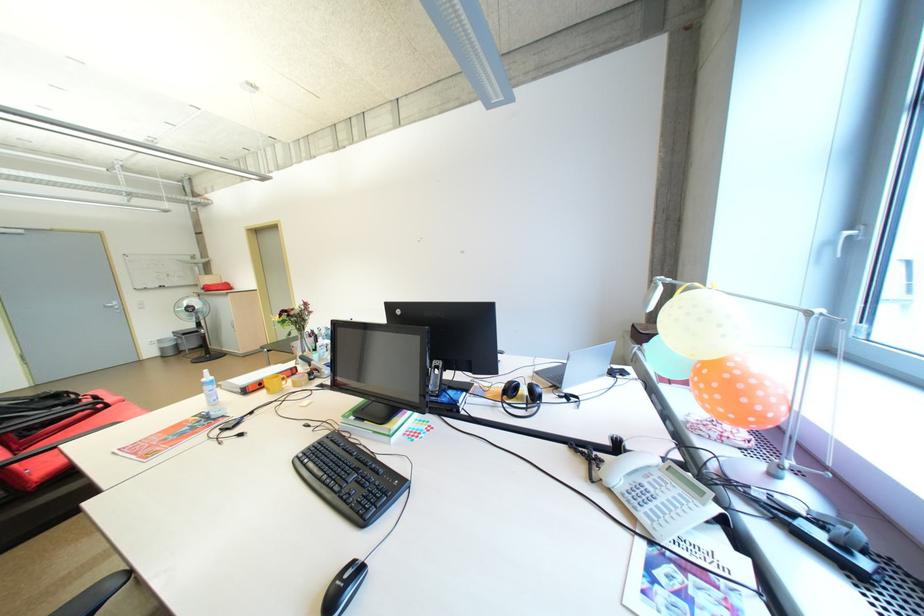
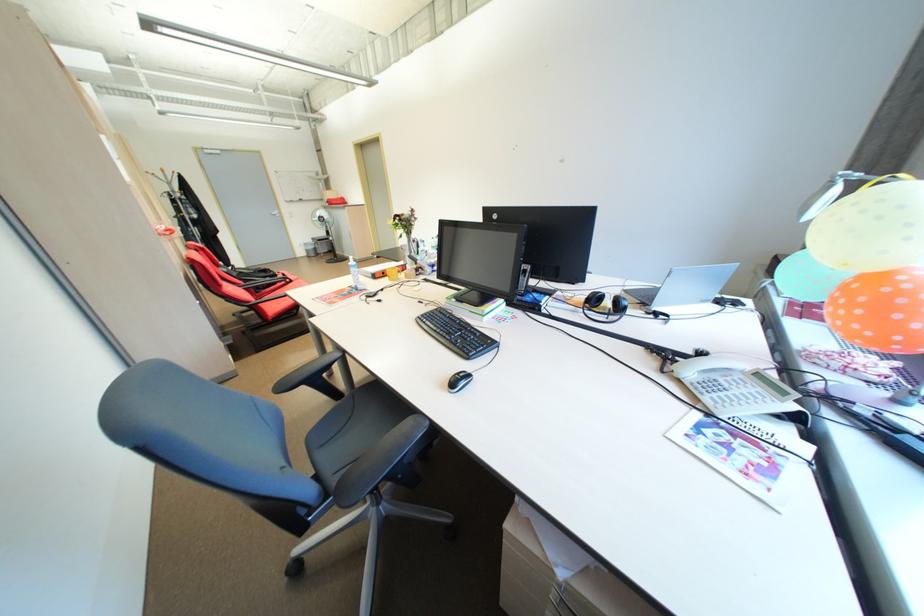
Find the pixel in the second image that matches (x=356, y=576) in the first image.

(469, 376)